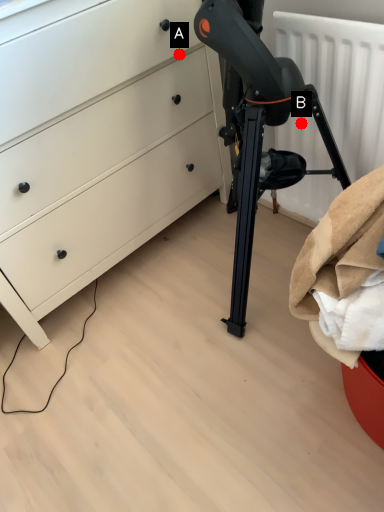
Question: Two points are circled on the image, labeled by A and B beside each circle. Which point is further to the camera?

Choices:
 (A) A is further
 (B) B is further

Answer: (B)